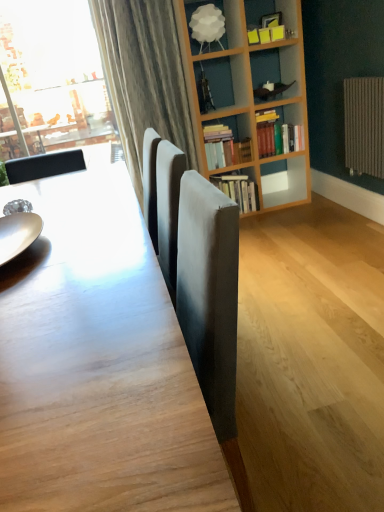
Question: Which direction should I rotate to look at slightly worn paper book at center, which is the third book from top to bottom, — up or down?

Choices:
 (A) down
 (B) up

Answer: (B)

Question: Considering the relative sizes of hardcover books at upper right, the second book from the top, and shiny silver plate at left in the image provided, is hardcover books at upper right, the second book from the top, bigger than shiny silver plate at left?

Choices:
 (A) yes
 (B) no

Answer: (A)

Question: Considering the relative positions of hardcover books at upper right, the second book from the bottom, and shiny silver plate at left in the image provided, is hardcover books at upper right, the second book from the bottom, to the right of shiny silver plate at left from the viewer's perspective?

Choices:
 (A) yes
 (B) no

Answer: (A)

Question: Can you confirm if hardcover books at upper right, the second book from the bottom, is shorter than shiny silver plate at left?

Choices:
 (A) no
 (B) yes

Answer: (A)

Question: Is hardcover books at upper right, the second book from the top, thinner than shiny silver plate at left?

Choices:
 (A) yes
 (B) no

Answer: (A)

Question: From the image's perspective, is hardcover books at upper right, the second book from the bottom, below shiny silver plate at left?

Choices:
 (A) yes
 (B) no

Answer: (B)

Question: Are hardcover books at upper right, the second book from the bottom, and shiny silver plate at left far apart?

Choices:
 (A) yes
 (B) no

Answer: (A)

Question: Is the position of hardcover books at upper right, the second book from the top, more distant than that of white matte lampshade at upper center?

Choices:
 (A) no
 (B) yes

Answer: (B)

Question: Is white matte lampshade at upper center surrounded by hardcover books at upper right, the second book from the bottom?

Choices:
 (A) yes
 (B) no

Answer: (B)

Question: Is hardcover books at upper right, the second book from the top, touching white matte lampshade at upper center?

Choices:
 (A) no
 (B) yes

Answer: (A)

Question: From a real-world perspective, is hardcover books at upper right, the second book from the top, physically below white matte lampshade at upper center?

Choices:
 (A) yes
 (B) no

Answer: (A)

Question: Does hardcover books at upper right, the second book from the bottom, have a smaller size compared to white matte lampshade at upper center?

Choices:
 (A) yes
 (B) no

Answer: (B)

Question: From the image's perspective, is hardcover books at upper right, the second book from the bottom, over white matte lampshade at upper center?

Choices:
 (A) yes
 (B) no

Answer: (B)

Question: Is slightly worn paper book at center, which is the third book from top to bottom, with shiny silver plate at left?

Choices:
 (A) no
 (B) yes

Answer: (A)